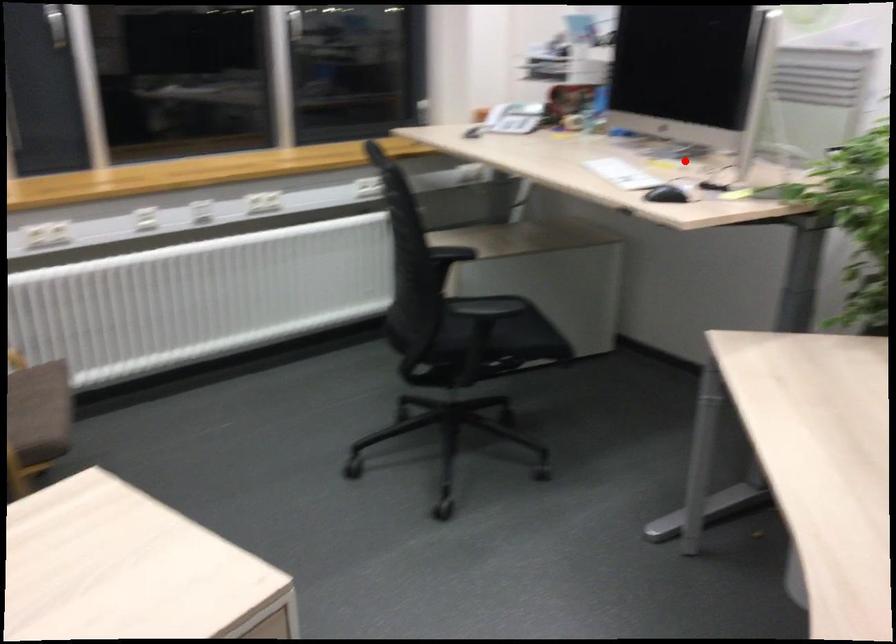
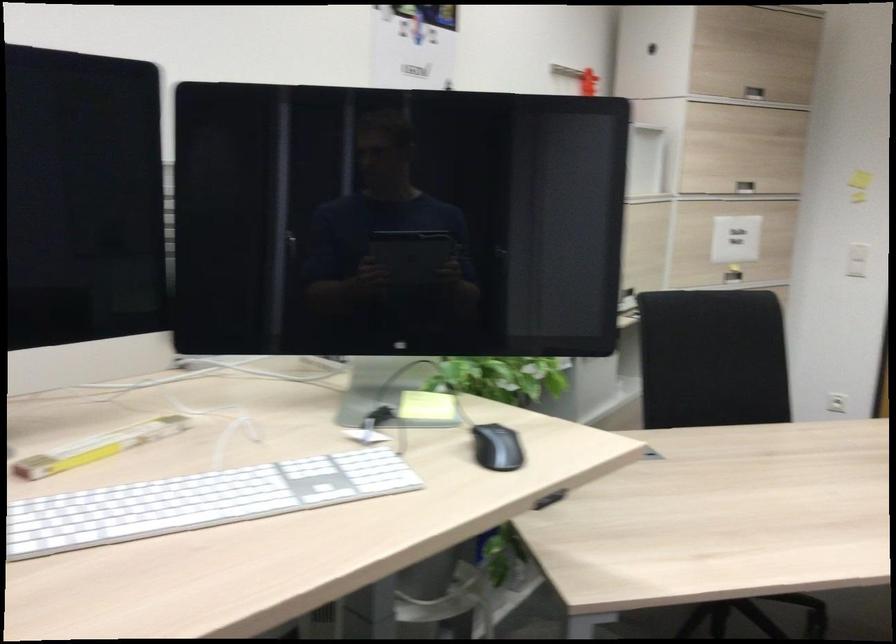
Question: A red point is marked in image1. In image2, is the corresponding 3D point closer to the camera or farther? Reply with the corresponding letter.

Choices:
 (A) The corresponding 3D point is closer.
 (B) The corresponding 3D point is farther.

Answer: (A)